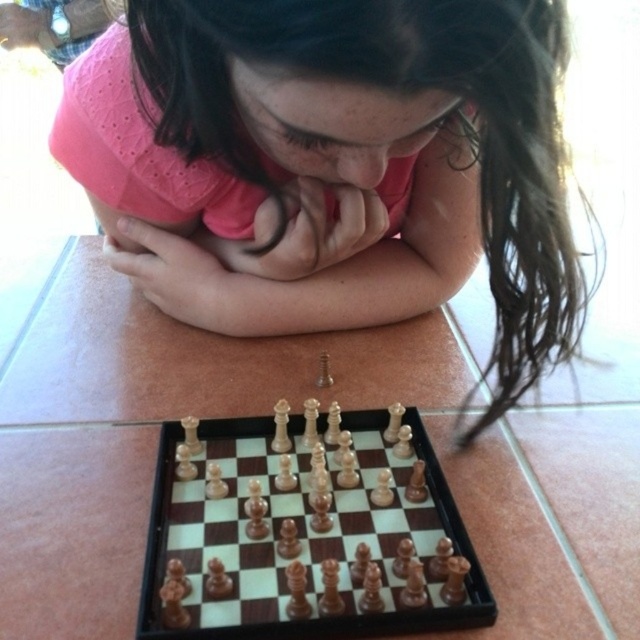
You are a tailor measuring the distance between the pink matte shirt at center and the wooden chess set at center. The minimum required distance for accurate measurements is 20 centimeters. Is the current distance sufficient?

The pink matte shirt at center and wooden chess set at center are 19.94 centimeters apart from each other. Since 19.94 cm is less than the required 20 cm, the distance is insufficient for accurate measurements.

In the scene shown: You are a photographer trying to capture a closeup of the pink matte shirt at center and the wooden chess set at center. Since you want both to be in focus, which object should you adjust your camera focus to prioritize?

The pink matte shirt at center is bigger than the wooden chess set at center, so you should prioritize focusing on the pink matte shirt at center to ensure both are in focus.